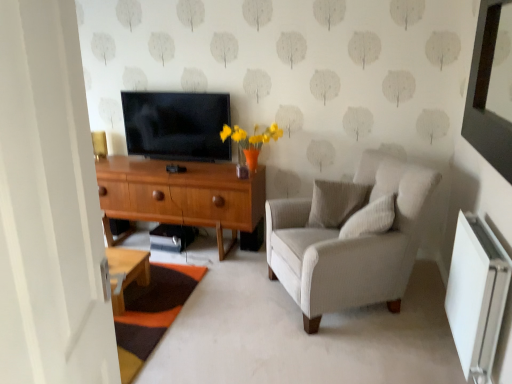
Question: Should I look upward or downward to see white textured pillow at center, which is counted as the 1th pillow, starting from the back?

Choices:
 (A) down
 (B) up

Answer: (A)

Question: Could you tell me if white textured pillow at center, marked as the 2th pillow in a front-to-back arrangement, is turned towards wooden desk at center?

Choices:
 (A) yes
 (B) no

Answer: (B)

Question: Does white textured pillow at center, marked as the 2th pillow in a front-to-back arrangement, appear on the right side of wooden desk at center?

Choices:
 (A) no
 (B) yes

Answer: (B)

Question: Considering the relative sizes of white textured pillow at center, which is counted as the 1th pillow, starting from the back, and wooden desk at center in the image provided, is white textured pillow at center, which is counted as the 1th pillow, starting from the back, bigger than wooden desk at center?

Choices:
 (A) no
 (B) yes

Answer: (A)

Question: Is white textured pillow at center, which is counted as the 1th pillow, starting from the back, shorter than wooden desk at center?

Choices:
 (A) yes
 (B) no

Answer: (A)

Question: Is white textured pillow at center, marked as the 2th pillow in a front-to-back arrangement, positioned in front of wooden desk at center?

Choices:
 (A) no
 (B) yes

Answer: (B)

Question: Is white textured pillow at center, marked as the 2th pillow in a front-to-back arrangement, further to the viewer compared to wooden desk at center?

Choices:
 (A) no
 (B) yes

Answer: (A)

Question: Does white plastic radiator at lower right have a greater height compared to white textured pillow at center, marked as the 2th pillow in a front-to-back arrangement?

Choices:
 (A) yes
 (B) no

Answer: (A)

Question: From a real-world perspective, is white plastic radiator at lower right over white textured pillow at center, which is counted as the 1th pillow, starting from the back?

Choices:
 (A) yes
 (B) no

Answer: (B)

Question: From the image's perspective, is white plastic radiator at lower right above white textured pillow at center, marked as the 2th pillow in a front-to-back arrangement?

Choices:
 (A) yes
 (B) no

Answer: (B)

Question: From the image's perspective, is white plastic radiator at lower right below white textured pillow at center, which is counted as the 1th pillow, starting from the back?

Choices:
 (A) no
 (B) yes

Answer: (B)

Question: Considering the relative sizes of white plastic radiator at lower right and white textured pillow at center, which is counted as the 1th pillow, starting from the back, in the image provided, is white plastic radiator at lower right thinner than white textured pillow at center, which is counted as the 1th pillow, starting from the back,?

Choices:
 (A) yes
 (B) no

Answer: (A)

Question: Is white plastic radiator at lower right positioned behind white textured pillow at center, marked as the 2th pillow in a front-to-back arrangement?

Choices:
 (A) no
 (B) yes

Answer: (A)

Question: Is white textured pillow at center, which is counted as the 1th pillow, starting from the back, looking in the opposite direction of matte black tv at center?

Choices:
 (A) no
 (B) yes

Answer: (A)